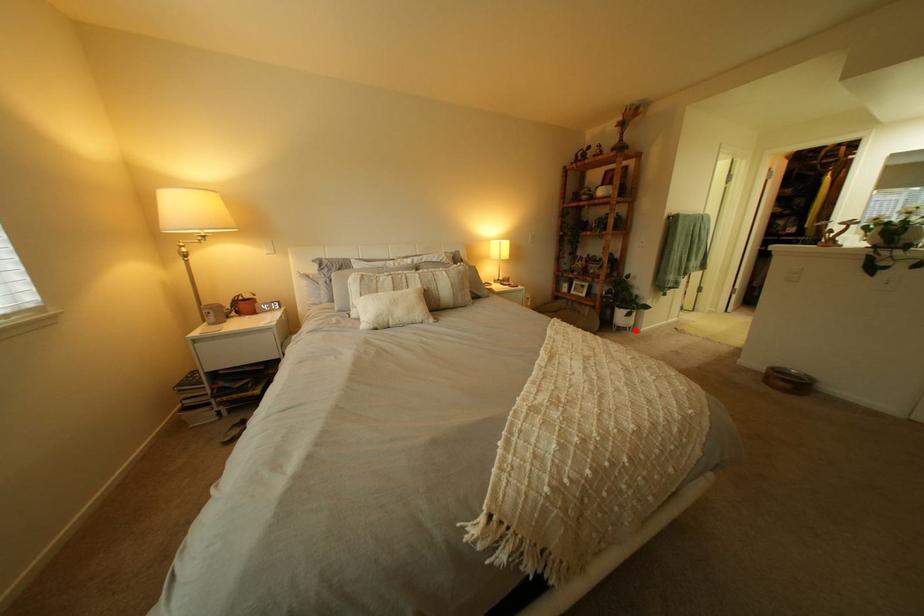
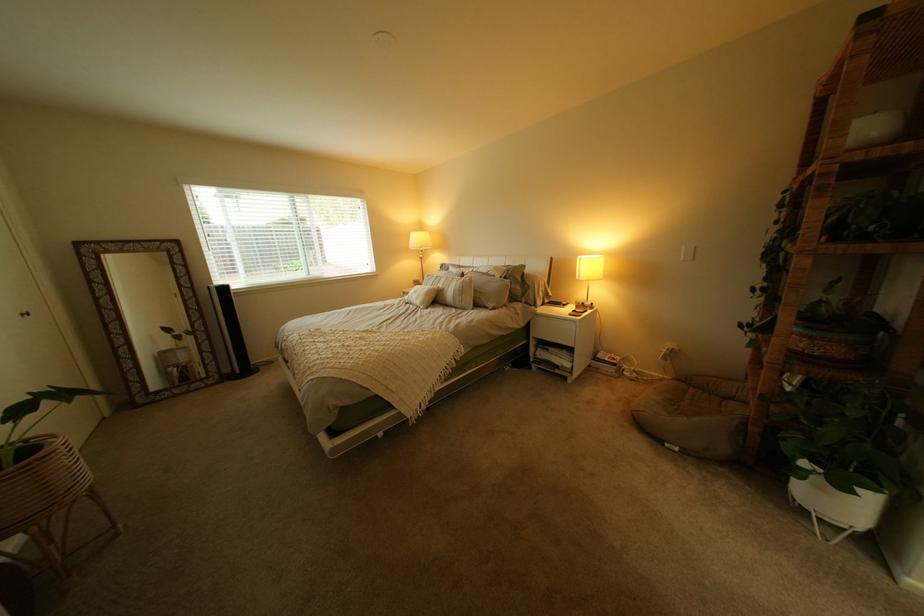
Question: I am providing you with two images of the same scene from different viewpoints. Given a red point in image1, look at the same physical point in image2. Is it:

Choices:
 (A) Closer to the viewpoint
 (B) Farther from the viewpoint

Answer: (B)